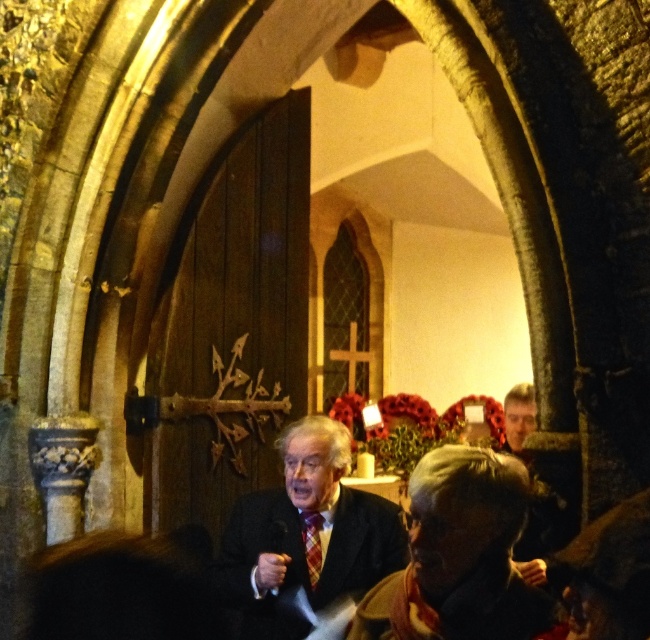
You are attending a formal event and need to determine which item of clothing is wider between the matte black suit at center and the plaid fabric tie at center. Can you identify which one is wider?

The matte black suit at center is wider than the plaid fabric tie at center according to the description provided.

From the picture: You are attending a formal event in the church and notice two items at the center of the image. Which item is located below the other? The options are the matte black suit at center and the plaid fabric tie at center.

The matte black suit at center is positioned under the plaid fabric tie at center, so the matte black suit at center is below the plaid fabric tie at center.

You are organizing a charity event and need to arrange seating based on the attendees clothing. You see a dark brown leather jacket at lower center and a matte black suit at center. Which attendee has a narrower clothing item?

The dark brown leather jacket at lower center has a narrower clothing item than the matte black suit at center.